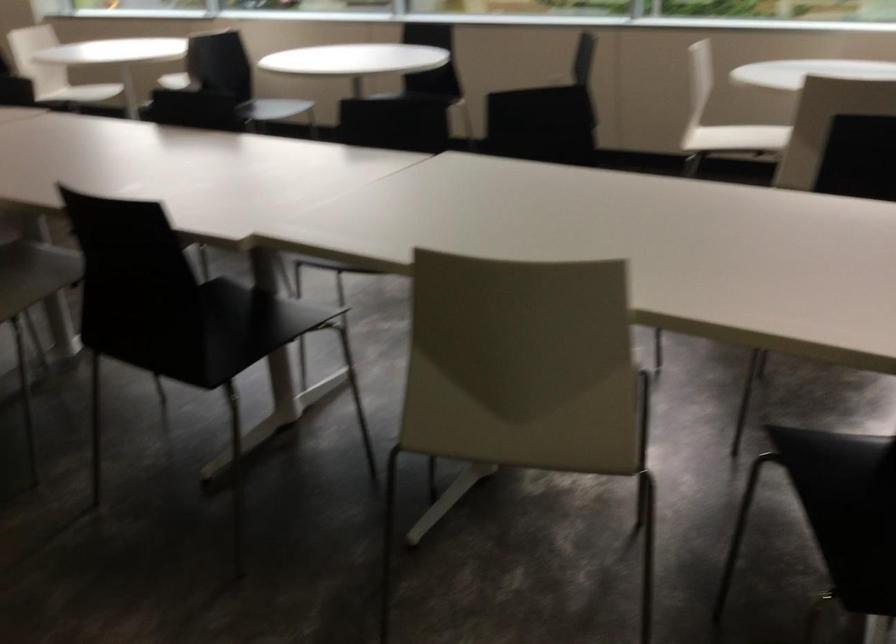
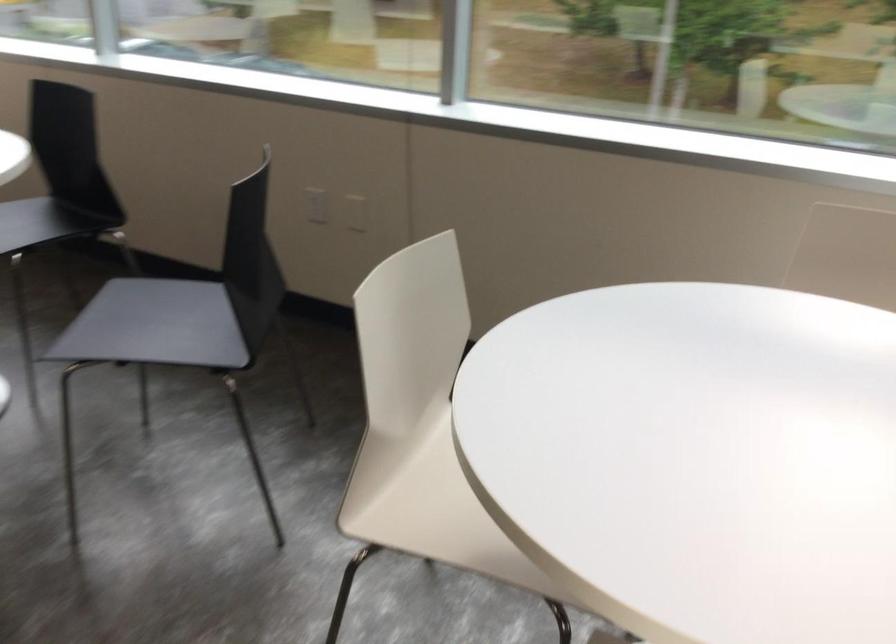
The images are taken continuously from a first-person perspective. In which direction are you moving?

The cameraman moved toward right, forward.